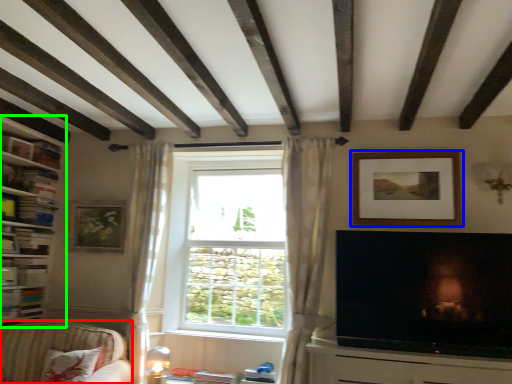
Question: Considering the real-world distances, which object is farthest from studio couch (highlighted by a red box)? picture frame (highlighted by a blue box) or shelf (highlighted by a green box)?

Choices:
 (A) picture frame
 (B) shelf

Answer: (A)